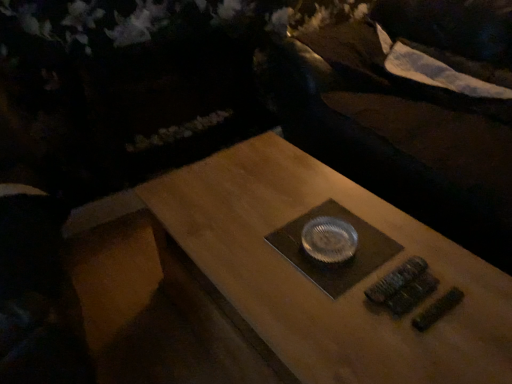
The image size is (512, 384). Describe the element at coordinates (268, 284) in the screenshot. I see `wooden table at center` at that location.

In order to face wooden table at center, should I rotate leftwards or rightwards?

Turn right by 7.508 degrees to look at wooden table at center.

You are a GUI agent. You are given a task and a screenshot of the screen. Output one action in this format:
    pyautogui.click(x=<x>, y=<y>)
    Task: Click on the wooden table at center
    The height and width of the screenshot is (384, 512).
    Given the screenshot: What is the action you would take?
    pyautogui.click(x=268, y=284)

Identify the location of wooden table at center. The image size is (512, 384). (268, 284).